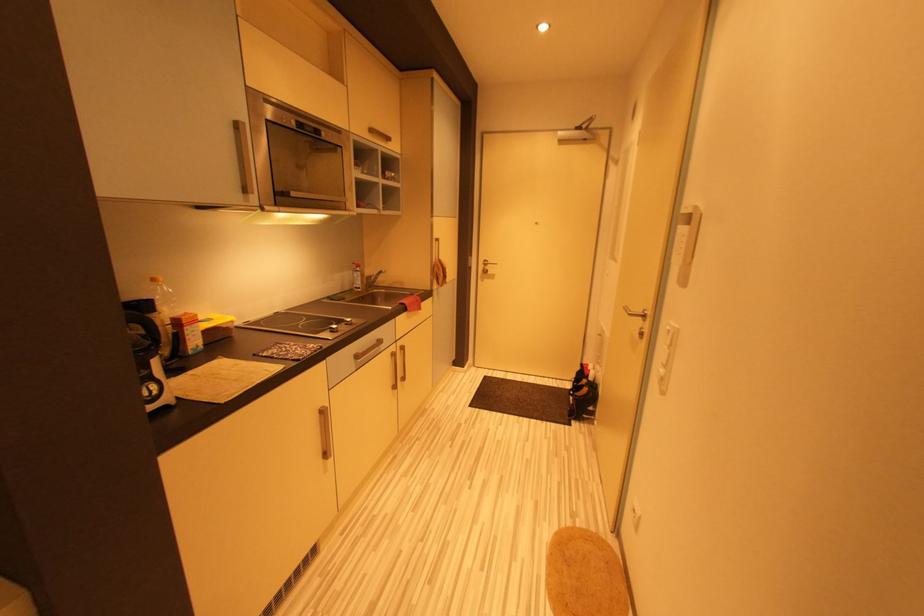
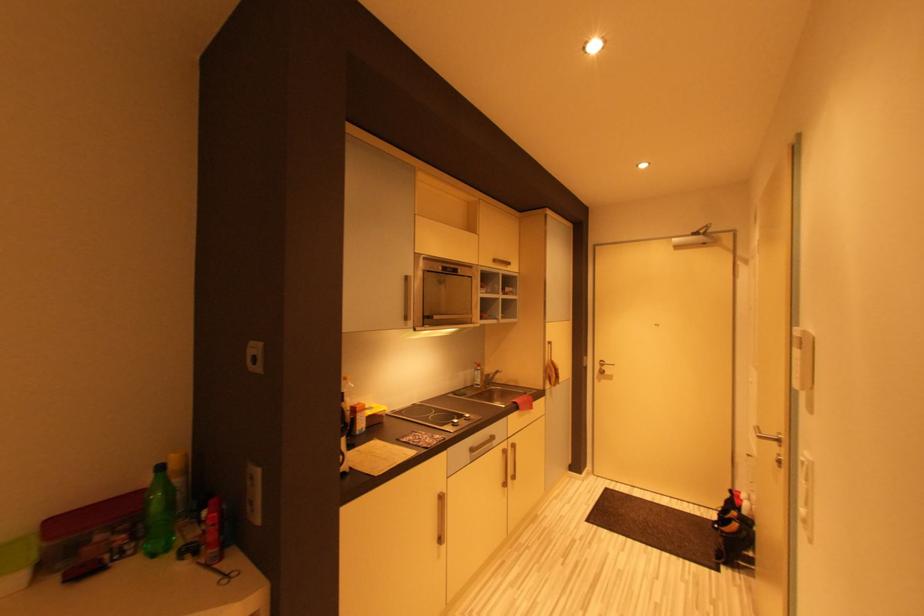
Question: How did the camera likely rotate?

Choices:
 (A) Left
 (B) Right
 (C) Up
 (D) Down

Answer: (A)